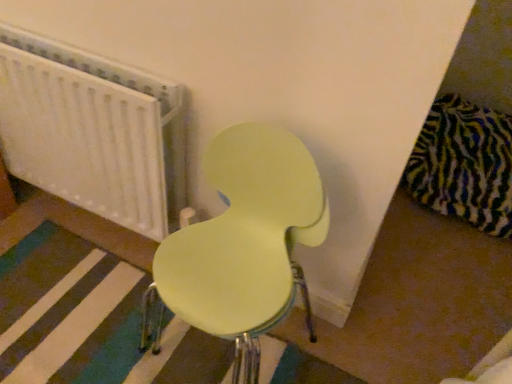
At what (x,y) coordinates should I click in order to perform the action: click on white textured radiator at upper left. Please return your answer as a coordinate pair (x, y). This screenshot has height=384, width=512. Looking at the image, I should click on (93, 131).

What is the approximate height of white textured radiator at upper left?

The height of white textured radiator at upper left is 65.15 centimeters.

This screenshot has height=384, width=512. What do you see at coordinates (93, 131) in the screenshot?
I see `white textured radiator at upper left` at bounding box center [93, 131].

Measure the distance between matte yellow chair at center and camera.

matte yellow chair at center is 34.20 inches away from camera.

Find the location of a particular element. This screenshot has height=384, width=512. matte yellow chair at center is located at coordinates (242, 245).

Describe the element at coordinates (242, 245) in the screenshot. Image resolution: width=512 pixels, height=384 pixels. I see `matte yellow chair at center` at that location.

You are a GUI agent. You are given a task and a screenshot of the screen. Output one action in this format:
    pyautogui.click(x=<x>, y=<y>)
    Task: Click on the white textured radiator at upper left
    This screenshot has height=384, width=512.
    Given the screenshot: What is the action you would take?
    pyautogui.click(x=93, y=131)

Between white textured radiator at upper left and matte yellow chair at center, which one appears on the left side from the viewer's perspective?

white textured radiator at upper left.

In the image, is white textured radiator at upper left positioned in front of or behind matte yellow chair at center?

In the image, white textured radiator at upper left appears behind matte yellow chair at center.

Is point (145, 75) closer or farther from the camera than point (206, 250)?

Point (145, 75) is farther from the camera than point (206, 250).

From the image's perspective, between white textured radiator at upper left and matte yellow chair at center, which one is located above?

white textured radiator at upper left appears higher in the image.

From a real-world perspective, who is located higher, white textured radiator at upper left or matte yellow chair at center?

In real-world perspective, matte yellow chair at center is above.

In the scene shown: Does white textured radiator at upper left have a lesser width compared to matte yellow chair at center?

Indeed, white textured radiator at upper left has a lesser width compared to matte yellow chair at center.

Is white textured radiator at upper left taller than matte yellow chair at center?

In fact, white textured radiator at upper left may be shorter than matte yellow chair at center.

Based on their sizes in the image, would you say white textured radiator at upper left is bigger or smaller than matte yellow chair at center?

white textured radiator at upper left is smaller than matte yellow chair at center.

Does white textured radiator at upper left contain matte yellow chair at center?

Actually, matte yellow chair at center is outside white textured radiator at upper left.

Are white textured radiator at upper left and matte yellow chair at center located far from each other?

They are positioned close to each other.

Is white textured radiator at upper left looking in the opposite direction of matte yellow chair at center?

white textured radiator at upper left is not turned away from matte yellow chair at center.

Consider the image. What's the angular difference between white textured radiator at upper left and matte yellow chair at center's facing directions?

They differ by 0.326 degrees in their facing directions.

Find the location of a particular element. The width and height of the screenshot is (512, 384). chair on the right of the white textured radiator at upper left is located at coordinates (242, 245).

Is matte yellow chair at center at the right side of white textured radiator at upper left?

Indeed, matte yellow chair at center is positioned on the right side of white textured radiator at upper left.

Which is in front, matte yellow chair at center or white textured radiator at upper left?

matte yellow chair at center is in front.

Is point (326, 210) closer to camera compared to point (30, 64)?

Yes.

From the image's perspective, relative to white textured radiator at upper left, is matte yellow chair at center above or below?

matte yellow chair at center is below white textured radiator at upper left.

From a real-world perspective, does matte yellow chair at center stand above white textured radiator at upper left?

Indeed, from a real-world perspective, matte yellow chair at center stands above white textured radiator at upper left.

Which of these two, matte yellow chair at center or white textured radiator at upper left, is wider?

With larger width is matte yellow chair at center.

Considering the relative sizes of matte yellow chair at center and white textured radiator at upper left in the image provided, is matte yellow chair at center shorter than white textured radiator at upper left?

In fact, matte yellow chair at center may be taller than white textured radiator at upper left.

Considering the sizes of objects matte yellow chair at center and white textured radiator at upper left in the image provided, who is smaller, matte yellow chair at center or white textured radiator at upper left?

Smaller between the two is white textured radiator at upper left.

Is matte yellow chair at center situated inside white textured radiator at upper left or outside?

matte yellow chair at center is located beyond the bounds of white textured radiator at upper left.

Would you consider matte yellow chair at center to be distant from white textured radiator at upper left?

No.

Is matte yellow chair at center oriented towards white textured radiator at upper left?

No.

How distant is matte yellow chair at center from white textured radiator at upper left?

matte yellow chair at center is 39.21 centimeters away from white textured radiator at upper left.

You are a GUI agent. You are given a task and a screenshot of the screen. Output one action in this format:
    pyautogui.click(x=<x>, y=<y>)
    Task: Click on the radiator to the left of matte yellow chair at center
    This screenshot has height=384, width=512.
    Given the screenshot: What is the action you would take?
    pyautogui.click(x=93, y=131)

At what (x,y) coordinates should I click in order to perform the action: click on radiator lying on the left of matte yellow chair at center. Please return your answer as a coordinate pair (x, y). The height and width of the screenshot is (384, 512). Looking at the image, I should click on (93, 131).

The height and width of the screenshot is (384, 512). Identify the location of radiator that appears below the matte yellow chair at center (from a real-world perspective). (93, 131).